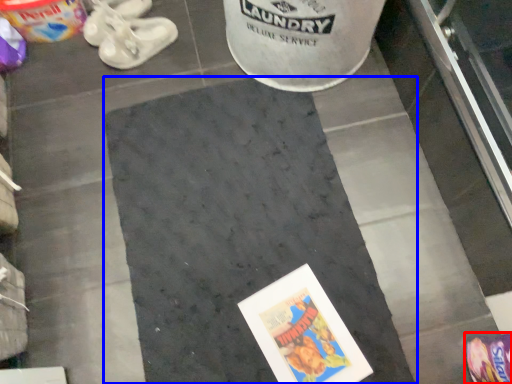
Question: Which point is further to the camera, footwear (highlighted by a red box) or concrete (highlighted by a blue box)?

Choices:
 (A) footwear
 (B) concrete

Answer: (B)